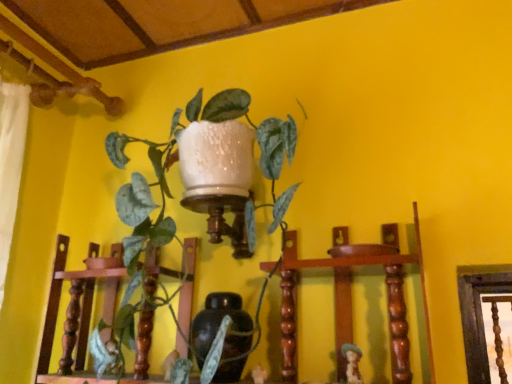
Question: Should I look upward or downward to see green glossy plant at upper center?

Choices:
 (A) up
 (B) down

Answer: (B)

Question: Can you confirm if matte brown figurine at lower right is wider than matte brown vase at center?

Choices:
 (A) no
 (B) yes

Answer: (A)

Question: Is matte brown vase at center inside matte brown figurine at lower right?

Choices:
 (A) no
 (B) yes

Answer: (A)

Question: Considering the relative sizes of matte brown figurine at lower right and matte brown vase at center in the image provided, is matte brown figurine at lower right bigger than matte brown vase at center?

Choices:
 (A) no
 (B) yes

Answer: (A)

Question: Considering the relative positions of matte brown figurine at lower right and matte brown vase at center in the image provided, is matte brown figurine at lower right in front of matte brown vase at center?

Choices:
 (A) yes
 (B) no

Answer: (A)

Question: Would you consider matte brown figurine at lower right to be distant from matte brown vase at center?

Choices:
 (A) yes
 (B) no

Answer: (B)

Question: Is matte brown figurine at lower right at the right side of matte brown vase at center?

Choices:
 (A) no
 (B) yes

Answer: (B)

Question: Is matte brown figurine at lower right positioned beyond the bounds of green glossy plant at upper center?

Choices:
 (A) yes
 (B) no

Answer: (A)

Question: Can you confirm if matte brown figurine at lower right is positioned to the left of green glossy plant at upper center?

Choices:
 (A) yes
 (B) no

Answer: (B)

Question: Does matte brown figurine at lower right have a greater height compared to green glossy plant at upper center?

Choices:
 (A) no
 (B) yes

Answer: (A)

Question: From the image's perspective, is matte brown figurine at lower right below green glossy plant at upper center?

Choices:
 (A) yes
 (B) no

Answer: (A)

Question: Does matte brown figurine at lower right lie in front of green glossy plant at upper center?

Choices:
 (A) no
 (B) yes

Answer: (A)

Question: Is matte brown figurine at lower right wider than green glossy plant at upper center?

Choices:
 (A) yes
 (B) no

Answer: (B)

Question: Is matte brown vase at center smaller than green glossy plant at upper center?

Choices:
 (A) yes
 (B) no

Answer: (A)